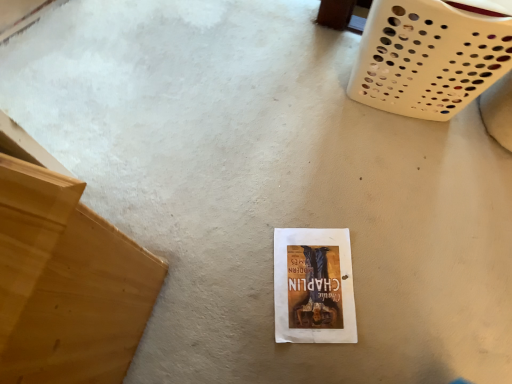
What do you see at coordinates (313, 286) in the screenshot? I see `white paper at center` at bounding box center [313, 286].

Locate an element on the screen. white plastic basket at upper right is located at coordinates (428, 58).

This screenshot has height=384, width=512. In order to click on white paper at center in this screenshot , I will do pos(313,286).

Considering the sizes of objects light brown wood at left and white plastic basket at upper right in the image provided, who is bigger, light brown wood at left or white plastic basket at upper right?

With larger size is light brown wood at left.

Which object is thinner, light brown wood at left or white plastic basket at upper right?

white plastic basket at upper right is thinner.

Is white plastic basket at upper right inside light brown wood at left?

Actually, white plastic basket at upper right is outside light brown wood at left.

Based on the photo, considering the relative positions of light brown wood at left and white plastic basket at upper right in the image provided, is light brown wood at left to the left of white plastic basket at upper right from the viewer's perspective?

Yes.

From the image's perspective, does light brown wood at left appear lower than white paper at center?

No, from the image's perspective, light brown wood at left is not beneath white paper at center.

Is the position of light brown wood at left less distant than that of white paper at center?

Yes, it is.

Is light brown wood at left not within white paper at center?

That's correct, light brown wood at left is outside of white paper at center.

From a real-world perspective, which is physically below, light brown wood at left or white paper at center?

In real-world perspective, white paper at center is lower.

From a real-world perspective, which object stands above the other?

light brown wood at left is physically above.

Considering the positions of objects white plastic basket at upper right and light brown wood at left in the image provided, who is behind, white plastic basket at upper right or light brown wood at left?

Positioned behind is white plastic basket at upper right.

Would you say white plastic basket at upper right is outside light brown wood at left?

Absolutely, white plastic basket at upper right is external to light brown wood at left.

From a real-world perspective, is white paper at center physically located above or below white plastic basket at upper right?

From a real-world perspective, white paper at center is physically below white plastic basket at upper right.

From the image's perspective, which object appears higher, white paper at center or white plastic basket at upper right?

white plastic basket at upper right.

Is white paper at center directly adjacent to white plastic basket at upper right?

No, white paper at center is not beside white plastic basket at upper right.

Is point (303, 270) positioned after point (85, 356)?

Yes, point (303, 270) is behind point (85, 356).

Measure the distance from white paper at center to light brown wood at left.

They are 18.18 inches apart.

From a real-world perspective, relative to light brown wood at left, is white paper at center vertically above or below?

From a real-world perspective, white paper at center is physically below light brown wood at left.

From their relative heights in the image, would you say white paper at center is taller or shorter than light brown wood at left?

white paper at center is shorter than light brown wood at left.

Does white plastic basket at upper right touch white paper at center?

No, white plastic basket at upper right is not next to white paper at center.

Is white plastic basket at upper right positioned behind white paper at center?

No, the depth of white plastic basket at upper right is less than that of white paper at center.

Is white plastic basket at upper right oriented away from white paper at center?

white plastic basket at upper right is not turned away from white paper at center.

This screenshot has width=512, height=384. I want to click on basket on the right of light brown wood at left, so click(x=428, y=58).

Identify the location of paperback book that appears below the light brown wood at left (from a real-world perspective). (313, 286).

Considering their positions, is light brown wood at left positioned further to white plastic basket at upper right than white paper at center?

Based on the image, light brown wood at left appears to be further to white plastic basket at upper right.

Considering their positions, is white paper at center positioned further to light brown wood at left than white plastic basket at upper right?

white plastic basket at upper right is positioned further to the anchor light brown wood at left.

Looking at this image, when comparing their distances from white plastic basket at upper right, does white paper at center or light brown wood at left seem closer?

Among the two, white paper at center is located nearer to white plastic basket at upper right.

Estimate the real-world distances between objects in this image. Which object is further from white paper at center, light brown wood at left or white plastic basket at upper right?

white plastic basket at upper right is positioned further to the anchor white paper at center.

Based on their spatial positions, is white plastic basket at upper right or light brown wood at left closer to white paper at center?

The object closer to white paper at center is light brown wood at left.

Based on their spatial positions, is white plastic basket at upper right or white paper at center closer to light brown wood at left?

white paper at center is positioned closer to the anchor light brown wood at left.

Where is `paperback book situated between light brown wood at left and white plastic basket at upper right from left to right`? paperback book situated between light brown wood at left and white plastic basket at upper right from left to right is located at coordinates (313, 286).